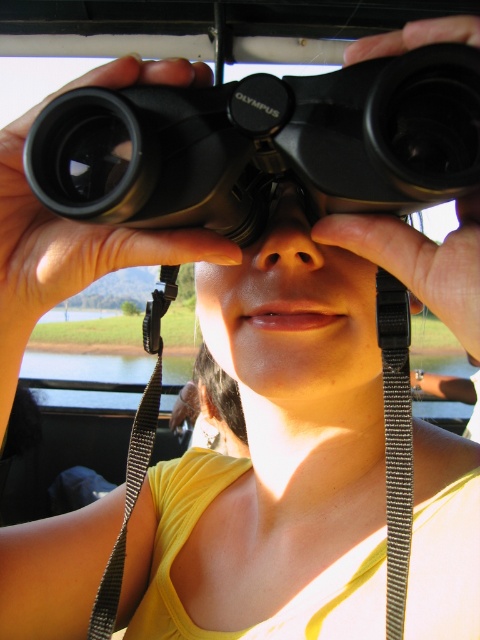
You are a photographer trying to capture a closeup shot of the black rubber binoculars at center and the black textured strap at center. Based on their positions, which object should you focus on first to ensure both are in sharp focus?

The black rubber binoculars at center are to the left of the black textured strap at center, so focusing on the black rubber binoculars at center first will ensure both are in sharp focus since they are closer to the camera.